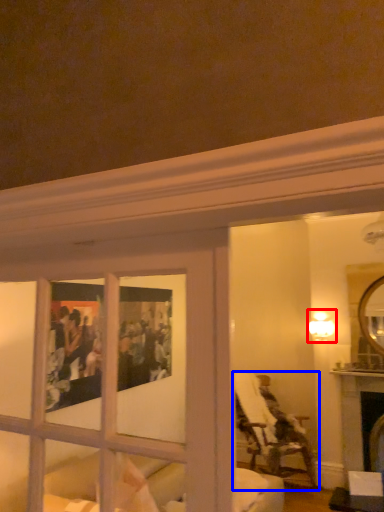
Question: Which object appears closest to the camera in this image, light fixture (highlighted by a red box) or chair (highlighted by a blue box)?

Choices:
 (A) light fixture
 (B) chair

Answer: (B)